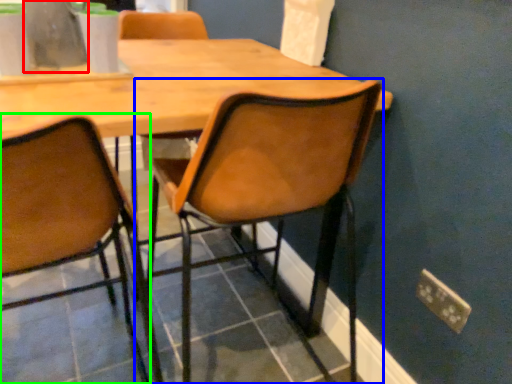
Question: Estimate the real-world distances between objects in this image. Which object is closer to vase (highlighted by a red box), chair (highlighted by a blue box) or chair (highlighted by a green box)?

Choices:
 (A) chair
 (B) chair

Answer: (B)